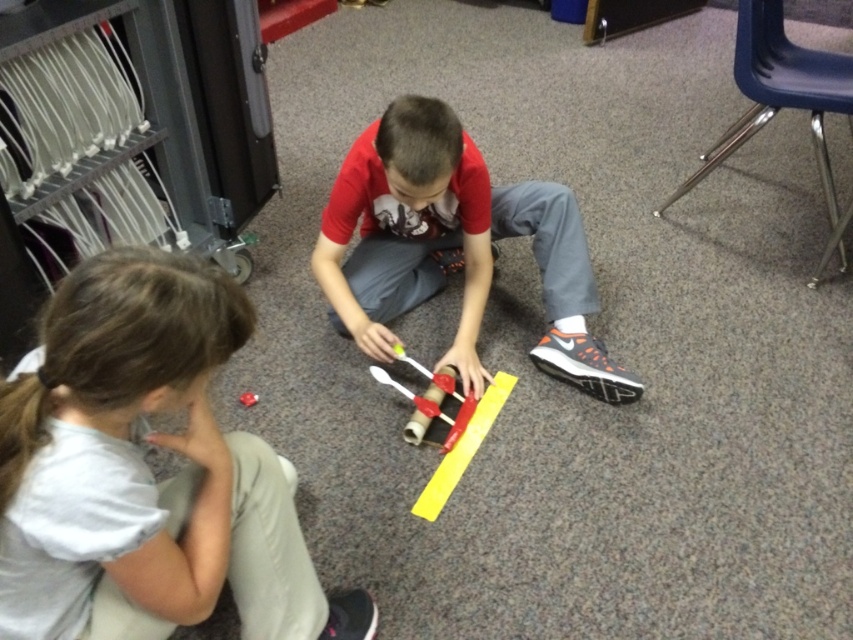
Question: Can you confirm if white matte shirt at lower left is bigger than matte red shirt at center?

Choices:
 (A) yes
 (B) no

Answer: (B)

Question: Which of the following is the farthest from the observer?

Choices:
 (A) (160, 321)
 (B) (438, 214)

Answer: (B)

Question: Does white matte shirt at lower left have a smaller size compared to matte red shirt at center?

Choices:
 (A) no
 (B) yes

Answer: (B)

Question: Among these points, which one is farthest from the camera?

Choices:
 (A) (264, 616)
 (B) (503, 225)

Answer: (B)

Question: Is white matte shirt at lower left positioned before matte red shirt at center?

Choices:
 (A) yes
 (B) no

Answer: (A)